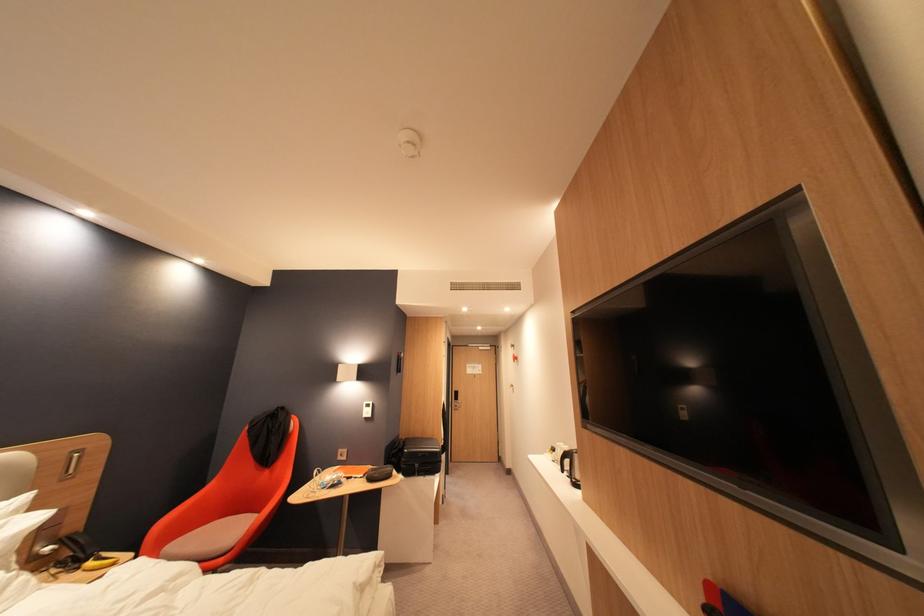
Find the location of a particular element. This screenshot has width=924, height=616. silver door handle is located at coordinates (456, 400).